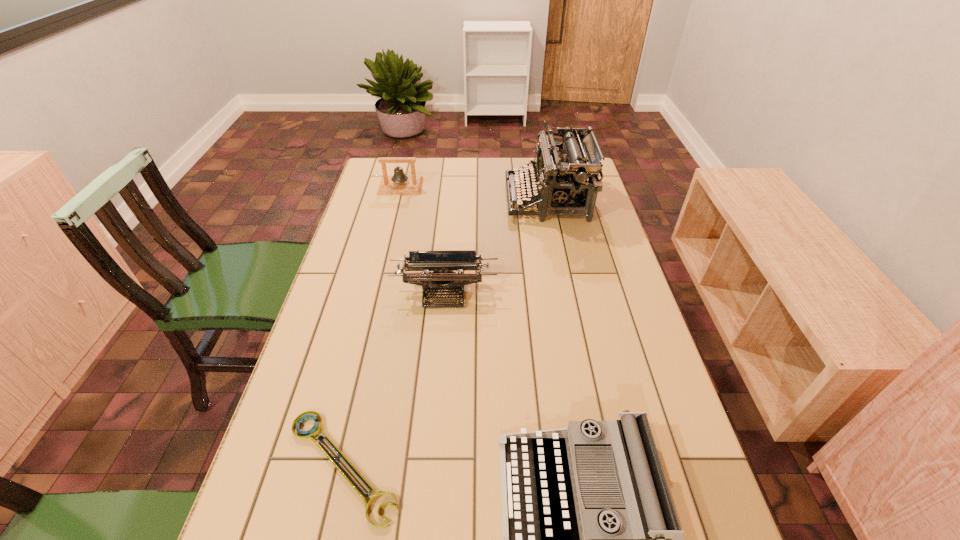
The image size is (960, 540). In order to click on vacant space situated on the back of the shortest object in this screenshot , I will do `click(376, 317)`.

At what (x,y) coordinates should I click in order to perform the action: click on typewriter at the far edge. Please return your answer as a coordinate pair (x, y). Looking at the image, I should click on (563, 181).

You are a GUI agent. You are given a task and a screenshot of the screen. Output one action in this format:
    pyautogui.click(x=<x>, y=<y>)
    Task: Click on the bell at the far edge
    
    Given the screenshot: What is the action you would take?
    pyautogui.click(x=398, y=184)

I want to click on bell that is at the left edge, so click(x=398, y=184).

Where is `wrench that is at the left edge`? wrench that is at the left edge is located at coordinates (309, 435).

Image resolution: width=960 pixels, height=540 pixels. Find the location of `object located in the right edge section of the desktop`. object located in the right edge section of the desktop is located at coordinates (563, 181).

The width and height of the screenshot is (960, 540). I want to click on object positioned at the far left corner, so click(x=398, y=184).

Locate an element on the screen. This screenshot has width=960, height=540. object situated at the far right corner is located at coordinates (563, 181).

Image resolution: width=960 pixels, height=540 pixels. In the image, there is a desktop. In order to click on free region at the far edge in this screenshot , I will do `click(514, 160)`.

This screenshot has height=540, width=960. In order to click on free location at the left edge of the desktop in this screenshot , I will do `click(390, 256)`.